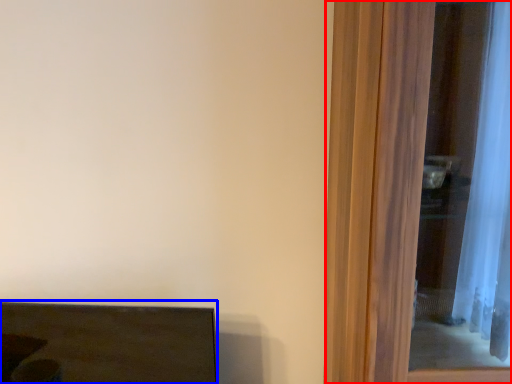
Question: Which of the following is the closest to the observer, screen door (highlighted by a red box) or furniture (highlighted by a blue box)?

Choices:
 (A) screen door
 (B) furniture

Answer: (A)